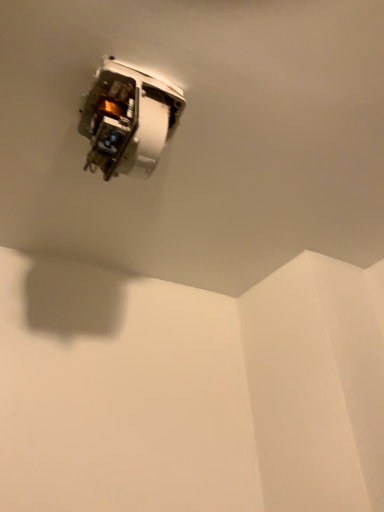
At what (x,y) coordinates should I click in order to perform the action: click on white plastic power plugs and sockets at upper center. Please return your answer as a coordinate pair (x, y). Image resolution: width=384 pixels, height=512 pixels. Looking at the image, I should click on (128, 120).

What do you see at coordinates (128, 120) in the screenshot?
I see `white plastic power plugs and sockets at upper center` at bounding box center [128, 120].

This screenshot has width=384, height=512. Identify the location of white plastic power plugs and sockets at upper center. (128, 120).